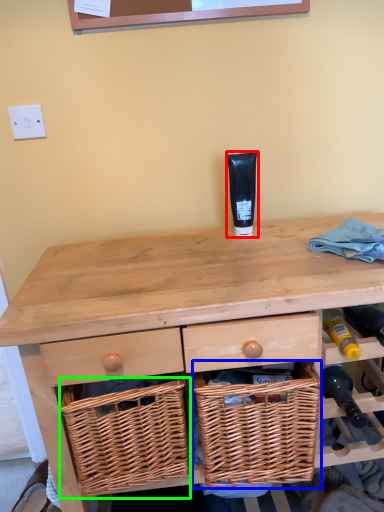
Question: Which object is the farthest from toiletry (highlighted by a red box)? Choose among these: picnic basket (highlighted by a blue box) or basket (highlighted by a green box).

Choices:
 (A) picnic basket
 (B) basket

Answer: (B)